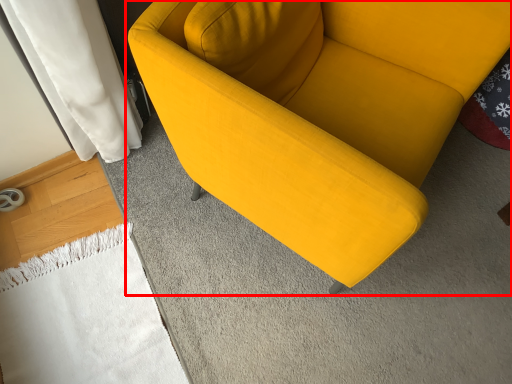
Question: From the image's perspective, considering the relative positions of studio couch (annotated by the red box) and blanket in the image provided, where is studio couch (annotated by the red box) located with respect to the staircase?

Choices:
 (A) below
 (B) above

Answer: (B)